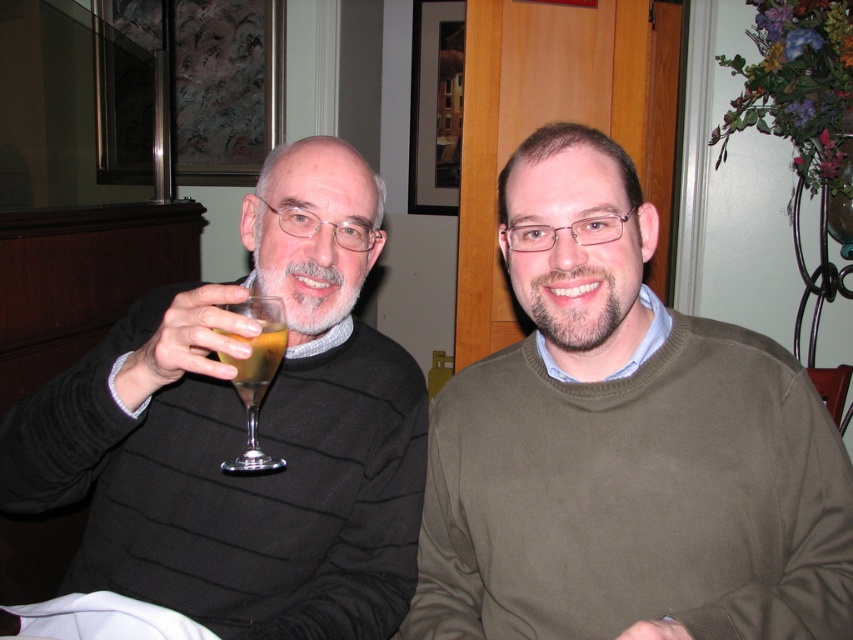
How distant is black sweater at left from translucent glass at upper left?

The distance of black sweater at left from translucent glass at upper left is 7.21 inches.

Is black sweater at left taller than translucent glass at upper left?

Yes, black sweater at left is taller than translucent glass at upper left.

Locate an element on the screen. The width and height of the screenshot is (853, 640). black sweater at left is located at coordinates (245, 433).

Is olive-green sweater at center wider than translucent glass at upper left?

Yes.

Between point (695, 486) and point (256, 397), which one is positioned in front?

Point (256, 397) is in front.

I want to click on olive-green sweater at center, so click(x=624, y=445).

Is black sweater at left to the left of clear glass wine glass at left from the viewer's perspective?

Correct, you'll find black sweater at left to the left of clear glass wine glass at left.

Does point (326, 189) come behind point (219, 358)?

Yes, it is behind point (219, 358).

Where is `black sweater at left`? The image size is (853, 640). black sweater at left is located at coordinates (245, 433).